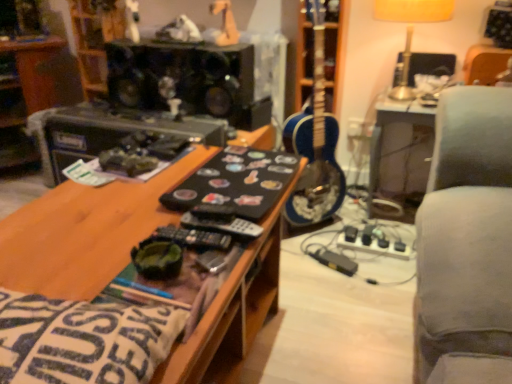
I want to click on free space in front of black matte remote at center, so click(x=200, y=289).